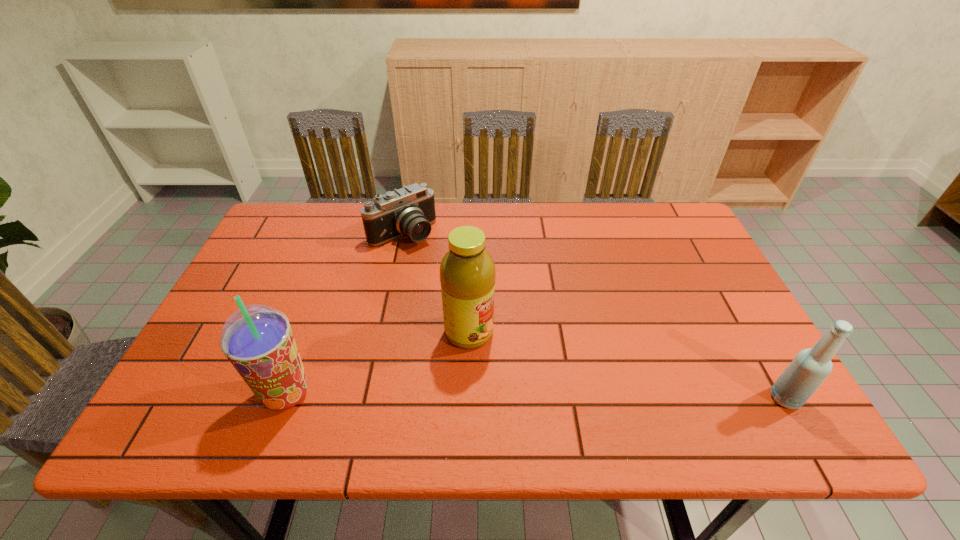
Locate an element on the screen. This screenshot has height=540, width=960. free space between the second shortest object and the second object from left to right is located at coordinates (593, 316).

Find the location of a particular element. Image resolution: width=960 pixels, height=540 pixels. unoccupied area between the shortest object and the leftmost object is located at coordinates (345, 314).

The height and width of the screenshot is (540, 960). In order to click on vacant space in between the second farthest object and the smoothie in this screenshot , I will do `click(377, 363)`.

Locate an element on the screen. The height and width of the screenshot is (540, 960). vacant space that is in between the fruit juice and the rightmost object is located at coordinates (627, 365).

Find the location of a particular element. The height and width of the screenshot is (540, 960). blank region between the fruit juice and the second object from left to right is located at coordinates (436, 283).

Where is `free space that is in between the leftmost object and the second object from left to right`? Image resolution: width=960 pixels, height=540 pixels. free space that is in between the leftmost object and the second object from left to right is located at coordinates (345, 314).

Where is `object that stands as the third closest to the shortest object`? object that stands as the third closest to the shortest object is located at coordinates (810, 367).

The width and height of the screenshot is (960, 540). I want to click on the third closest object to the farthest object, so click(810, 367).

Find the location of a particular element. This screenshot has width=960, height=540. vacant position in the image that satisfies the following two spatial constraints: 1. on the back side of the leftmost object; 2. on the right side of the fruit juice is located at coordinates (309, 333).

Where is `vacant space that satisfies the following two spatial constraints: 1. on the back side of the smoothie; 2. on the right side of the fruit juice`? The width and height of the screenshot is (960, 540). vacant space that satisfies the following two spatial constraints: 1. on the back side of the smoothie; 2. on the right side of the fruit juice is located at coordinates (309, 333).